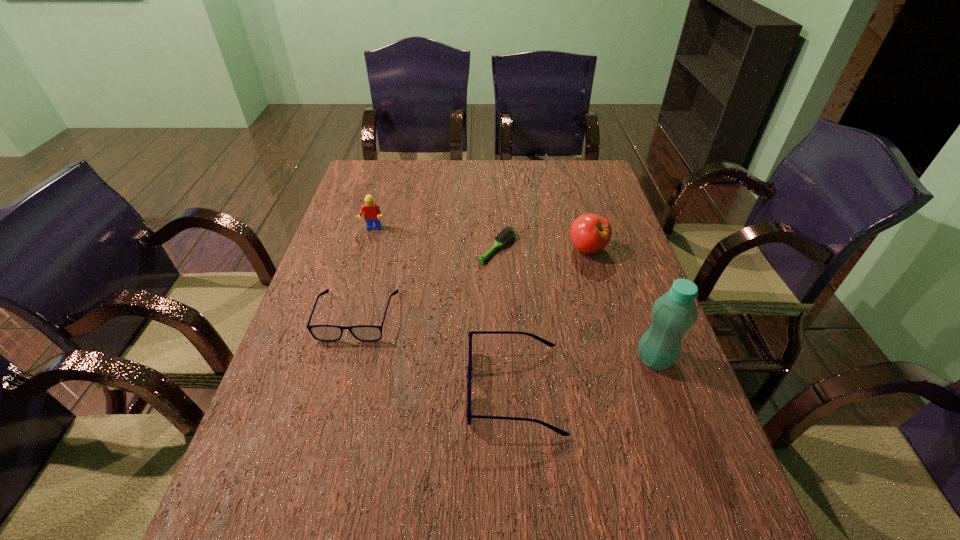
This screenshot has height=540, width=960. What are the coordinates of `vacant space at the far edge` in the screenshot? It's located at (443, 167).

Locate an element on the screen. vacant space at the near edge is located at coordinates (502, 461).

The image size is (960, 540). In order to click on vacant region at the left edge of the desktop in this screenshot , I will do `click(340, 259)`.

Where is `free space at the right edge of the desktop`? The height and width of the screenshot is (540, 960). free space at the right edge of the desktop is located at coordinates (x=607, y=201).

Locate an element on the screen. The width and height of the screenshot is (960, 540). vacant space at the far left corner of the desktop is located at coordinates (356, 180).

The image size is (960, 540). Identify the location of vacant region at the near left corner of the desktop. (306, 478).

Where is `free space between the apple and the shortest object`? The width and height of the screenshot is (960, 540). free space between the apple and the shortest object is located at coordinates (542, 249).

I want to click on empty space between the farther spectacles and the shortest object, so click(427, 282).

Image resolution: width=960 pixels, height=540 pixels. Identify the location of vacant space in between the nearer spectacles and the Lego. point(444,309).

Where is `vacant space that's between the Lego and the tallest object`? This screenshot has width=960, height=540. vacant space that's between the Lego and the tallest object is located at coordinates (514, 294).